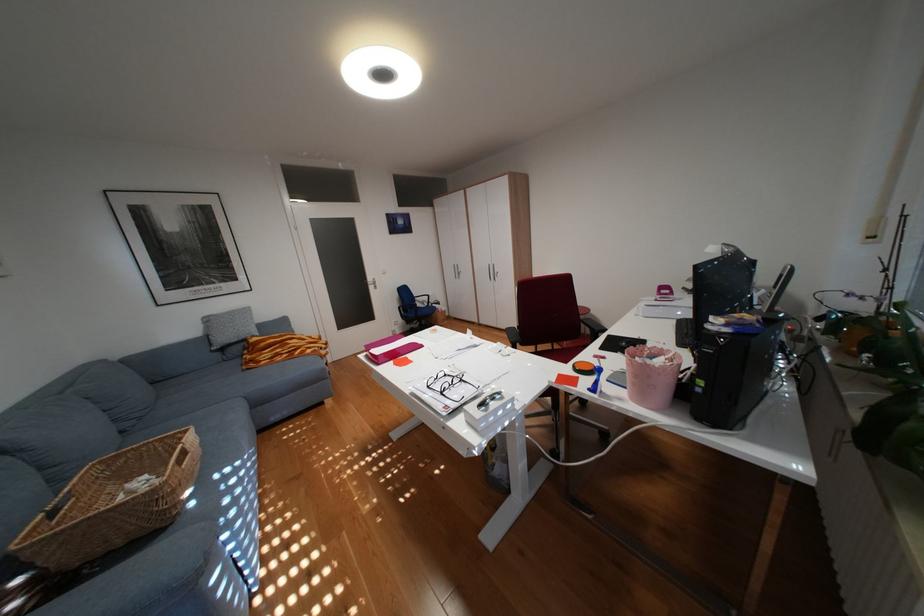
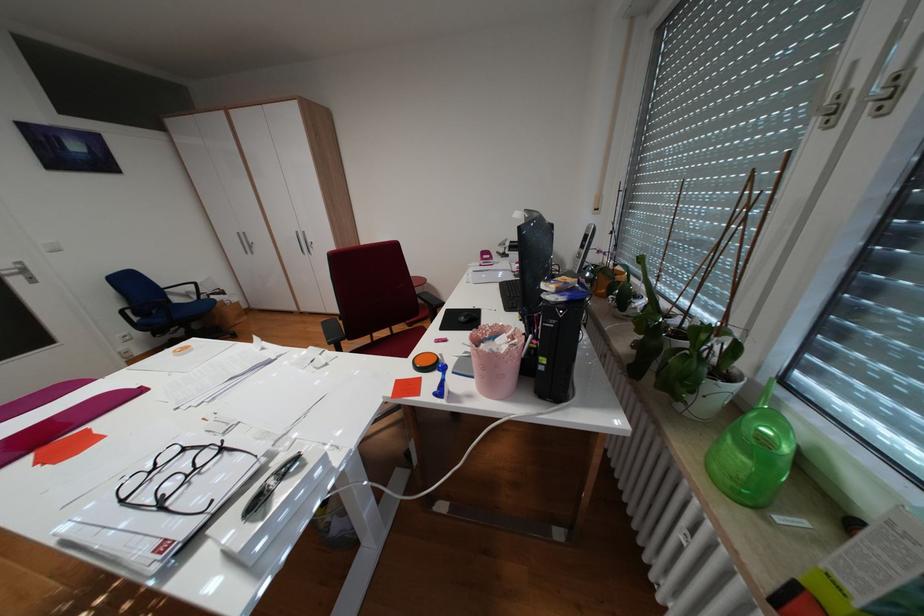
Question: The images are taken continuously from a first-person perspective. In which direction is your viewpoint rotating?

Choices:
 (A) Left
 (B) Right
 (C) Up
 (D) Down

Answer: (B)